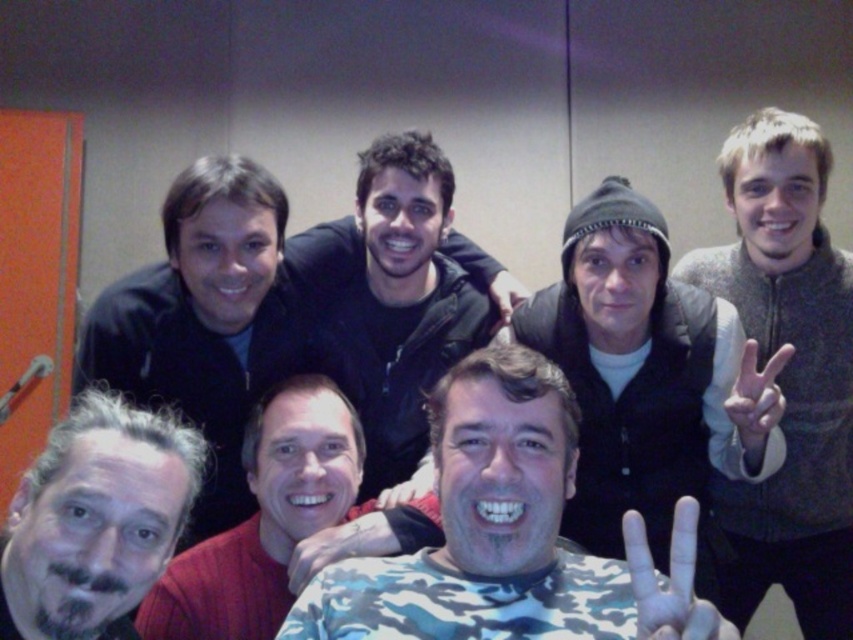
Between camouflage fabric shirt at center and gray hair at center, which one has more height?

camouflage fabric shirt at center is taller.

Is point (479, 390) positioned in front of point (32, 497)?

No, (479, 390) is further to viewer.

Is point (328, 595) less distant than point (49, 435)?

Yes.

Find the location of a particular element. The image size is (853, 640). camouflage fabric shirt at center is located at coordinates (509, 534).

Is white matte hand at center right bigger than camouflage fabric hand at lower center?

Yes, white matte hand at center right is bigger than camouflage fabric hand at lower center.

Who is more distant from viewer, (775, 372) or (309, 577)?

The point (309, 577) is more distant.

The height and width of the screenshot is (640, 853). I want to click on white matte hand at center right, so click(756, 396).

Is point (311, 442) positioned after point (747, 387)?

Yes, point (311, 442) is behind point (747, 387).

Which is more to the left, camouflage shirt at center or white matte hand at center right?

camouflage shirt at center is more to the left.

Between point (273, 497) and point (741, 365), which one is positioned behind?

The point (273, 497) is more distant.

Image resolution: width=853 pixels, height=640 pixels. Find the location of `camouflage shirt at center`. camouflage shirt at center is located at coordinates (265, 518).